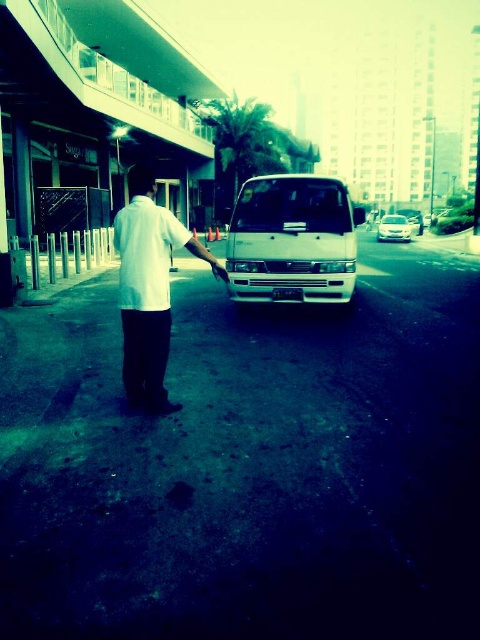
You are a delivery driver navigating through an urban area. You see two points marked on your GPS map at coordinates point (351, 280) and point (155, 275). Your GPS indicates that one of these points is closer to you. Which coordinate should you head towards to reach the closer point?

Point (155, 275) is closer to you because point (351, 280) is further away from the camera, meaning it is farther away in the scene.

Based on the photo, you are a pedestrian trying to cross the street. You see a white matte van at center and a metallic silver van at center. Which van is closer to the ground?

The white matte van at center is located below metallic silver van at center, so it is closer to the ground.

You are a delivery driver who needs to park your white matte van at center in a parking spot that can only accommodate vehicles up to the size of the white cotton shirt at center. Can your van fit in the parking spot?

The white matte van at center is larger in size than the white cotton shirt at center, so it cannot fit in the parking spot designed for vehicles the size of the white cotton shirt at center.